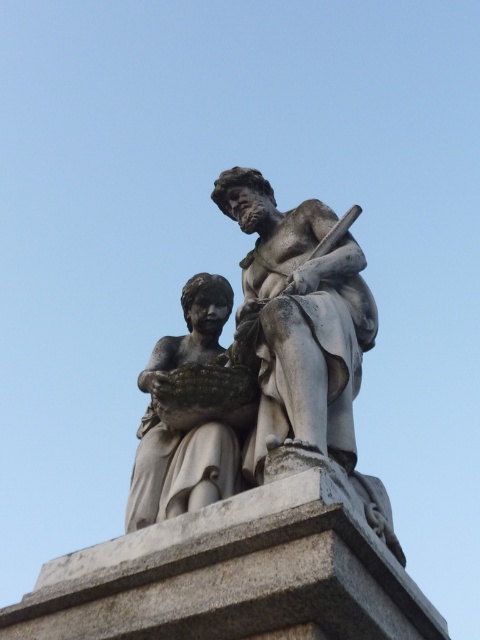
Describe the element at coordinates (261, 365) in the screenshot. I see `gray stone statue at center` at that location.

Who is higher up, gray stone statue at center or gray stone pedestal at center?

Positioned higher is gray stone statue at center.

Who is more forward, (137, 436) or (245, 572)?

Point (245, 572) is in front.

At what (x,y) coordinates should I click in order to perform the action: click on gray stone statue at center. Please return your answer as a coordinate pair (x, y). The image size is (480, 640). Looking at the image, I should click on (261, 365).

Can you confirm if gray stone statue at center is positioned to the right of matte stone child at center?

Yes, gray stone statue at center is to the right of matte stone child at center.

Is the position of gray stone statue at center more distant than that of matte stone child at center?

No, it is in front of matte stone child at center.

Does point (168, 456) come closer to viewer compared to point (191, 294)?

Yes, point (168, 456) is in front of point (191, 294).

Where is `gray stone statue at center`? This screenshot has height=640, width=480. gray stone statue at center is located at coordinates (261, 365).

Between gray stone pedestal at center and matte stone child at center, which one is positioned lower?

gray stone pedestal at center is below.

Can you confirm if gray stone pedestal at center is smaller than matte stone child at center?

No.

In order to click on gray stone pedestal at center in this screenshot , I will do `click(233, 577)`.